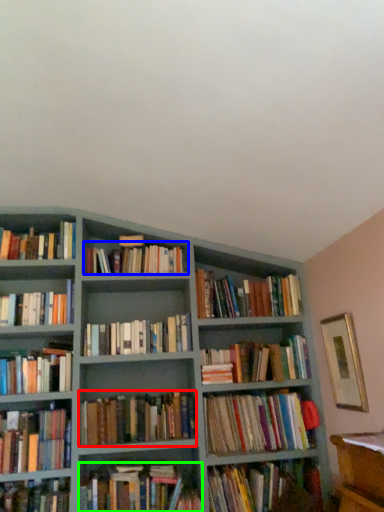
Question: Considering the real-world distances, which object is closest to book (highlighted by a red box)? book (highlighted by a blue box) or book (highlighted by a green box).

Choices:
 (A) book
 (B) book

Answer: (B)